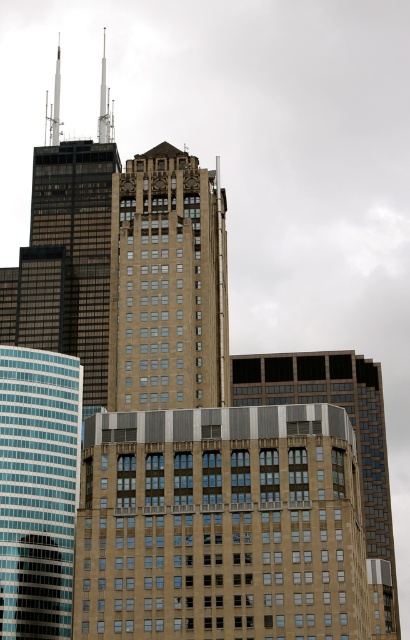
Question: Which of these objects is positioned farthest from the beige stone tower at center?

Choices:
 (A) matte glass skyscraper at left
 (B) brown glass building at center

Answer: (B)

Question: Can you confirm if beige stone tower at center is positioned below brown glass building at center?

Choices:
 (A) no
 (B) yes

Answer: (A)

Question: Which object is the farthest from the matte glass skyscraper at left?

Choices:
 (A) beige stone tower at center
 (B) brown glass building at center

Answer: (B)

Question: Estimate the real-world distances between objects in this image. Which object is farther from the brown glass building at center?

Choices:
 (A) beige stone tower at center
 (B) matte glass skyscraper at left

Answer: (A)

Question: Is beige stone tower at center further to camera compared to brown glass building at center?

Choices:
 (A) no
 (B) yes

Answer: (A)

Question: Is matte glass skyscraper at left to the right of brown glass building at center from the viewer's perspective?

Choices:
 (A) no
 (B) yes

Answer: (A)